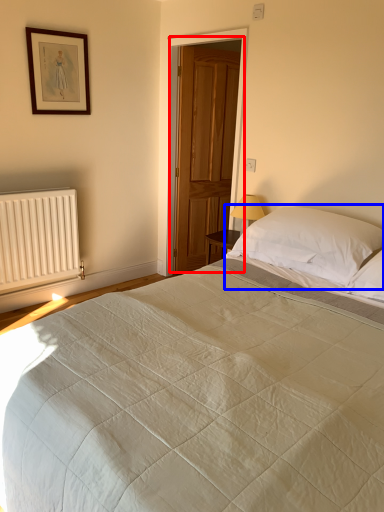
Question: Which object appears closest to the camera in this image, door (highlighted by a red box) or pillow (highlighted by a blue box)?

Choices:
 (A) door
 (B) pillow

Answer: (B)